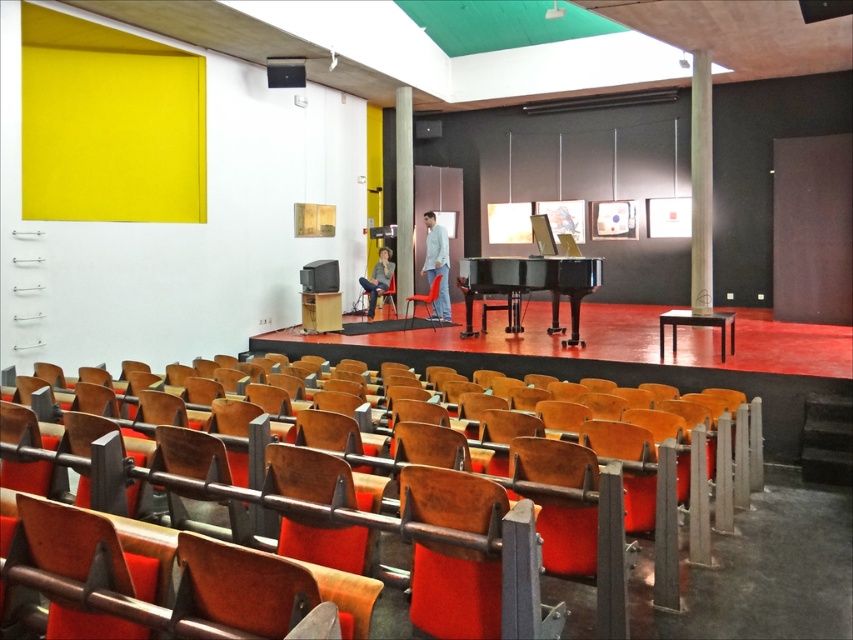
You are a stagehand who needs to move the white matte shirt at center and the black glossy piano at center to the storage room. Which object should you move first if you want to move the larger item first?

The black glossy piano at center is larger than the white matte shirt at center, so you should move the black glossy piano at center first.

You are a stagehand who needs to move a 2.0 meter long ladder from the wooden seat at lower center to the stage. Is there enough space between them to move the ladder horizontally without tilting it?

The distance between the wooden seat at lower center and the stage is 1.94 meters. Since the ladder is 2.0 meters long, it is slightly longer than the available space. Therefore, the ladder cannot be moved horizontally without tilting it.

You are a stagehand in the concert hall and need to determine the distance from the camera to two points on the stage. The points are labeled as point 1 at coordinates point (549, 272) and point 2 at coordinates point (426, 221). Which point is closer to the camera?

Point (549, 272) is closer to the camera than point (426, 221).